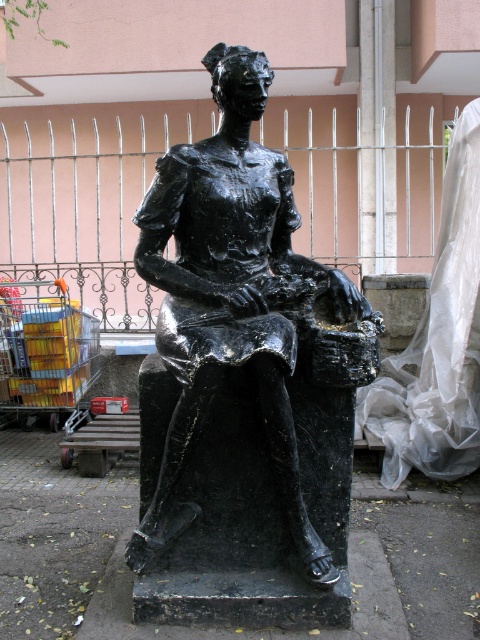
Does black polished statue at center appear over metallic yellow cart at lower left?

Yes, black polished statue at center is above metallic yellow cart at lower left.

Does black polished statue at center have a larger size compared to metallic yellow cart at lower left?

Yes, black polished statue at center is bigger than metallic yellow cart at lower left.

Locate an element on the screen. This screenshot has width=480, height=640. black polished statue at center is located at coordinates (240, 305).